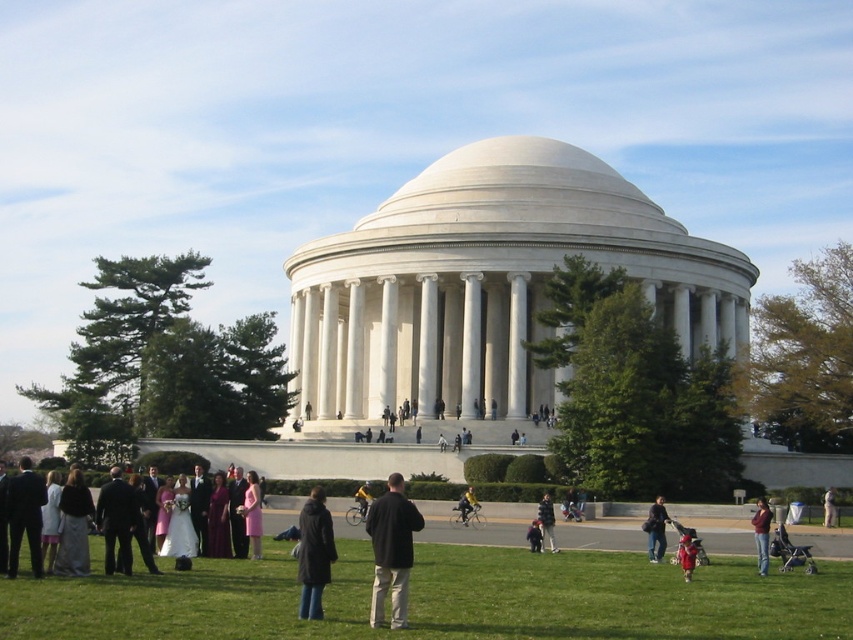
Is green grass at lower center to the right of matte white dress at center from the viewer's perspective?

Yes, green grass at lower center is to the right of matte white dress at center.

Which is in front, point (605, 586) or point (28, 524)?

Point (605, 586)

Who is more forward, (262,632) or (84,572)?

Point (262,632) is more forward.

The width and height of the screenshot is (853, 640). In order to click on green grass at lower center in this screenshot , I will do `click(440, 600)`.

In the scene shown: Between black matte jacket at center and white cotton baseball uniform at center, which one is positioned lower?

white cotton baseball uniform at center is lower down.

Can you confirm if black matte jacket at center is bigger than white cotton baseball uniform at center?

Yes, black matte jacket at center is bigger than white cotton baseball uniform at center.

Locate an element on the screen. The height and width of the screenshot is (640, 853). black matte jacket at center is located at coordinates (392, 550).

Does denim jacket at lower right have a greater width compared to dark blue jacket at center?

Yes.

Can you confirm if denim jacket at lower right is taller than dark blue jacket at center?

Yes.

Locate an element on the screen. Image resolution: width=853 pixels, height=640 pixels. denim jacket at lower right is located at coordinates (761, 532).

Where is `denim jacket at lower right`? denim jacket at lower right is located at coordinates (761, 532).